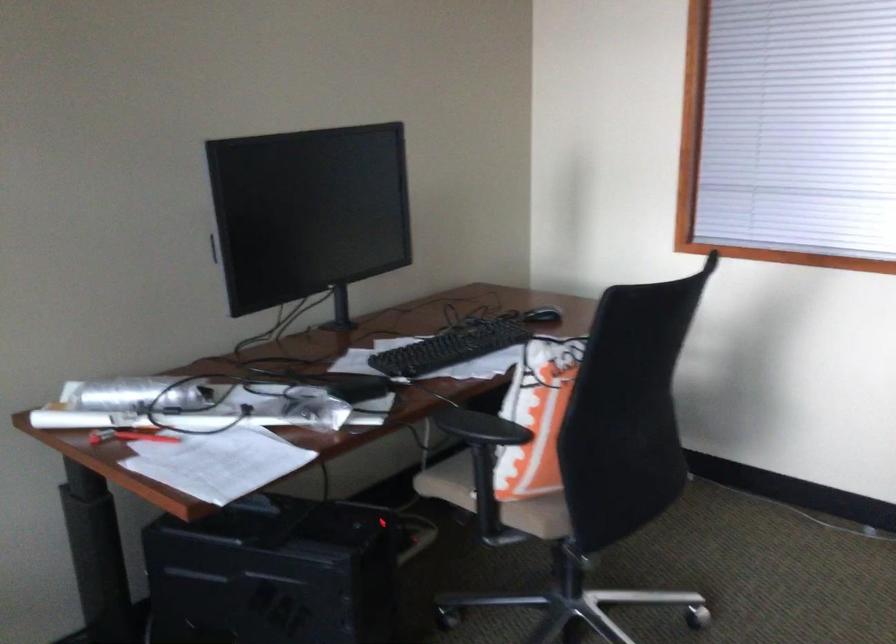
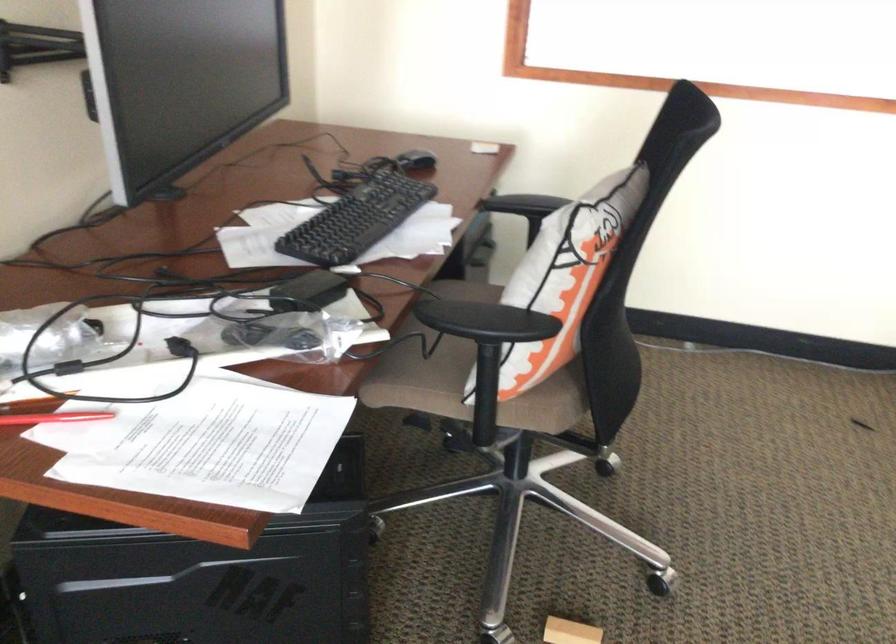
The images are taken continuously from a first-person perspective. In which direction are you moving?

The cameraman walked toward left, forward.